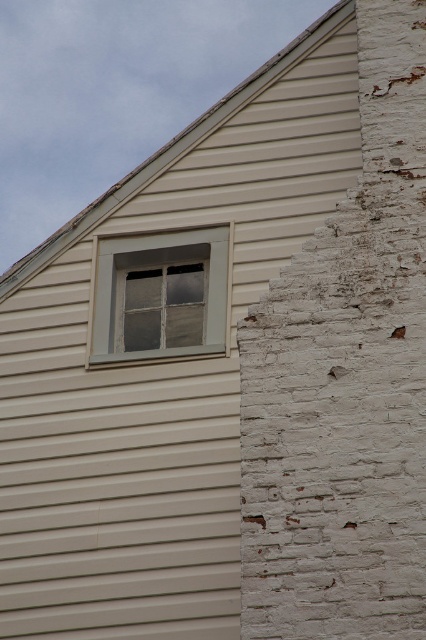
You are a painter assessing the exterior of a building. You need to paint both the white painted brick siding at right and the clear glass window at upper center. Which of these two objects requires more paint?

The white painted brick siding at right requires more paint because it is larger in size than the clear glass window at upper center.

You are standing in front of a building and notice the white painted brick siding at right and the clear glass window at upper center. Which object is positioned to the right of the other?

The white painted brick siding at right is to the right of the clear glass window at upper center.

You are standing in front of the building and notice two points marked on the wall. The first point is at coordinate point(301, 433) and the second is at point(218, 250). Which point is closer to you?

Point(301, 433) is in front of point(218, 250), so the first point is closer to you.